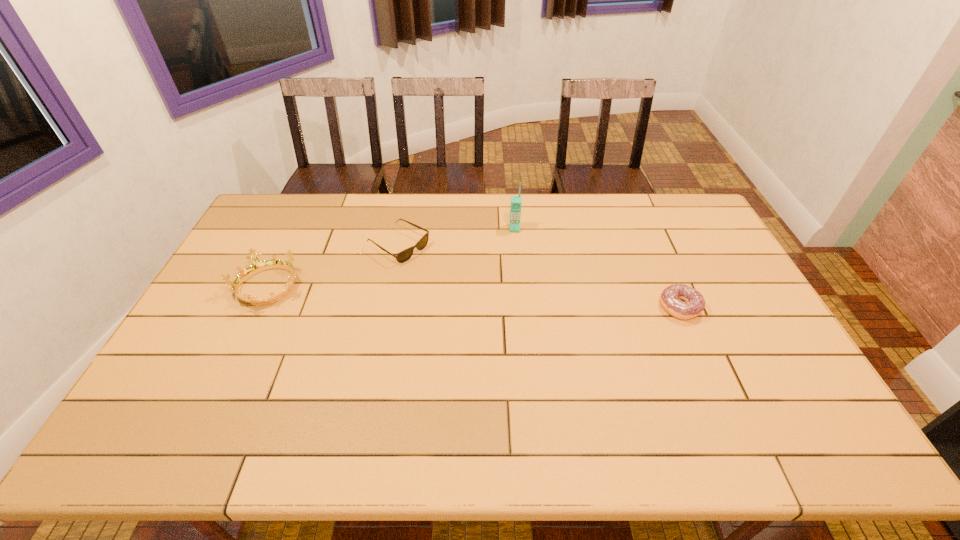
Where is `vacant position located 0.320m on the keypad of the cellular telephone`? The height and width of the screenshot is (540, 960). vacant position located 0.320m on the keypad of the cellular telephone is located at coordinates (514, 298).

Identify the location of vacant space situated 0.180m on the lenses of the third object from right to left. (463, 282).

The height and width of the screenshot is (540, 960). What are the coordinates of `free location located 0.080m on the lenses of the third object from right to left` in the screenshot? It's located at (439, 268).

Identify the location of blank space located 0.240m on the lenses of the third object from right to left. Image resolution: width=960 pixels, height=540 pixels. (477, 291).

This screenshot has width=960, height=540. In order to click on cellular telephone at the far edge in this screenshot , I will do `click(516, 201)`.

What are the coordinates of `sunglasses at the far edge` in the screenshot? It's located at (403, 256).

Locate an element on the screen. The height and width of the screenshot is (540, 960). object at the left edge is located at coordinates (257, 266).

In the image, there is a desktop. Identify the location of free space at the far edge. This screenshot has width=960, height=540. (415, 228).

Locate an element on the screen. vacant space at the near edge is located at coordinates (465, 393).

Where is `vacant region at the right edge of the desktop`? vacant region at the right edge of the desktop is located at coordinates coord(719,248).